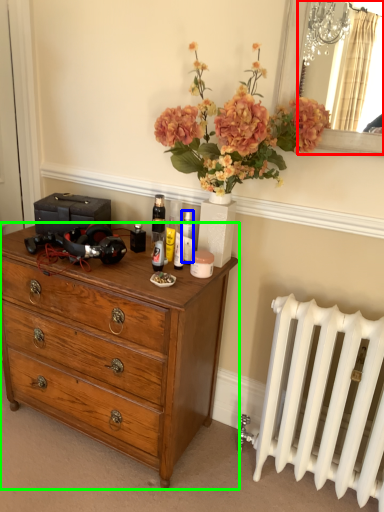
Question: Considering the real-world distances, which object is farthest from mirror (highlighted by a red box)? toiletry (highlighted by a blue box) or chest of drawers (highlighted by a green box)?

Choices:
 (A) toiletry
 (B) chest of drawers

Answer: (B)